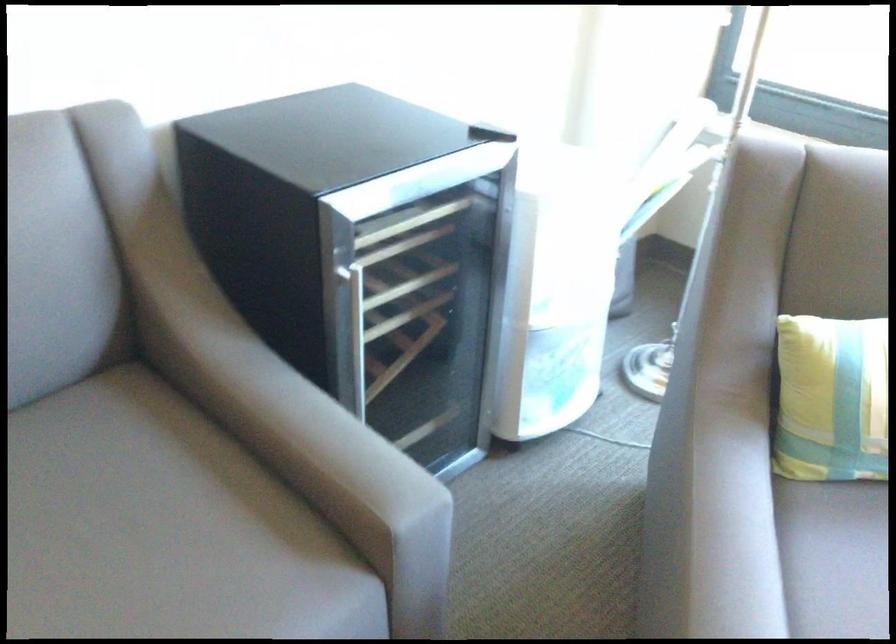
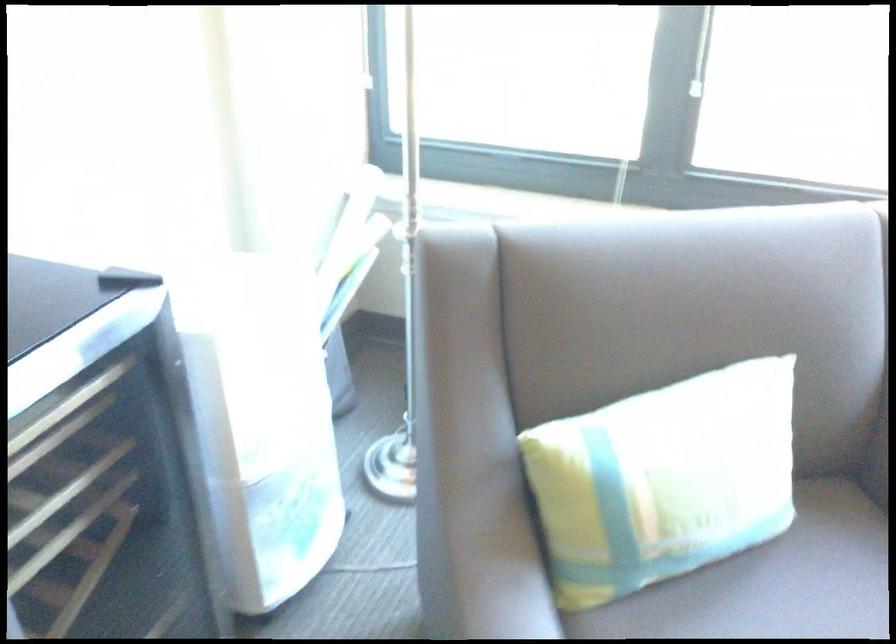
Question: The camera is either moving clockwise (left) or counter-clockwise (right) around the object. The first image is from the beginning of the video and the second image is from the end. Is the camera moving left or right when shooting the video?

Choices:
 (A) Left
 (B) Right

Answer: (A)